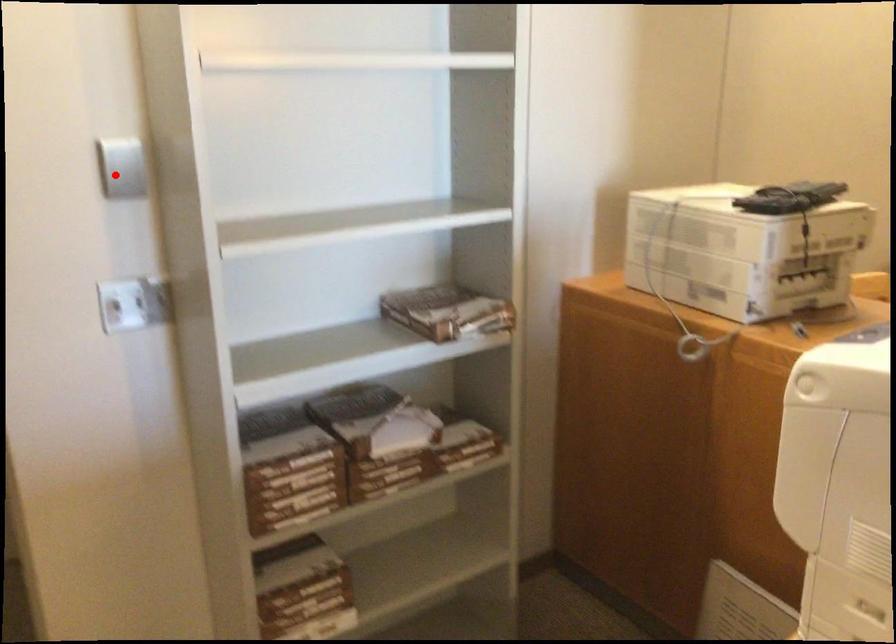
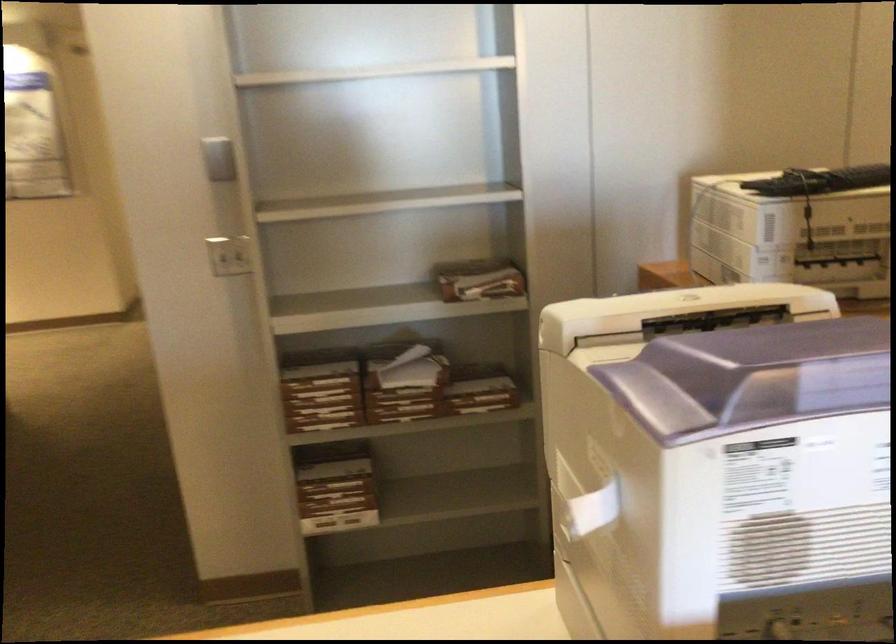
Question: I am providing you with two images of the same scene from different viewpoints. A red point is marked on the first image. At the location where the point appears in image 1, is it still visible in image 2?

Choices:
 (A) Yes
 (B) No

Answer: (A)